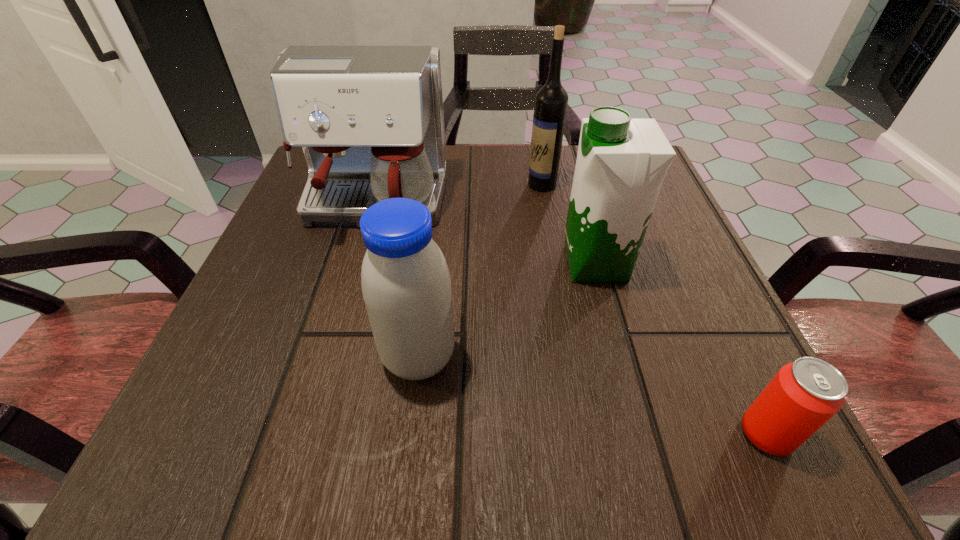
The width and height of the screenshot is (960, 540). I want to click on wine bottle, so click(551, 100).

Find the location of a particular element. This screenshot has height=540, width=960. the right soya milk is located at coordinates (621, 163).

At what (x,y) coordinates should I click in order to perform the action: click on coffee maker. Please return your answer as a coordinate pair (x, y). This screenshot has width=960, height=540. Looking at the image, I should click on (370, 121).

The height and width of the screenshot is (540, 960). Find the location of `the left soya milk`. the left soya milk is located at coordinates (406, 286).

Where is `the fourth farthest object`? the fourth farthest object is located at coordinates (406, 286).

This screenshot has width=960, height=540. Find the location of `beer can`. beer can is located at coordinates (805, 394).

The image size is (960, 540). What are the coordinates of `the rightmost object` in the screenshot? It's located at (805, 394).

Where is `vacant space located 0.240m on the label of the wine bottle`? This screenshot has width=960, height=540. vacant space located 0.240m on the label of the wine bottle is located at coordinates (412, 185).

Where is `vacant space located on the label of the wine bottle`? The width and height of the screenshot is (960, 540). vacant space located on the label of the wine bottle is located at coordinates (378, 185).

You are a GUI agent. You are given a task and a screenshot of the screen. Output one action in this format:
    pyautogui.click(x=<x>, y=<y>)
    Task: Click on the vacant space situated 0.060m on the label of the wine bottle
    The image size is (960, 540).
    Given the screenshot: What is the action you would take?
    pyautogui.click(x=498, y=185)